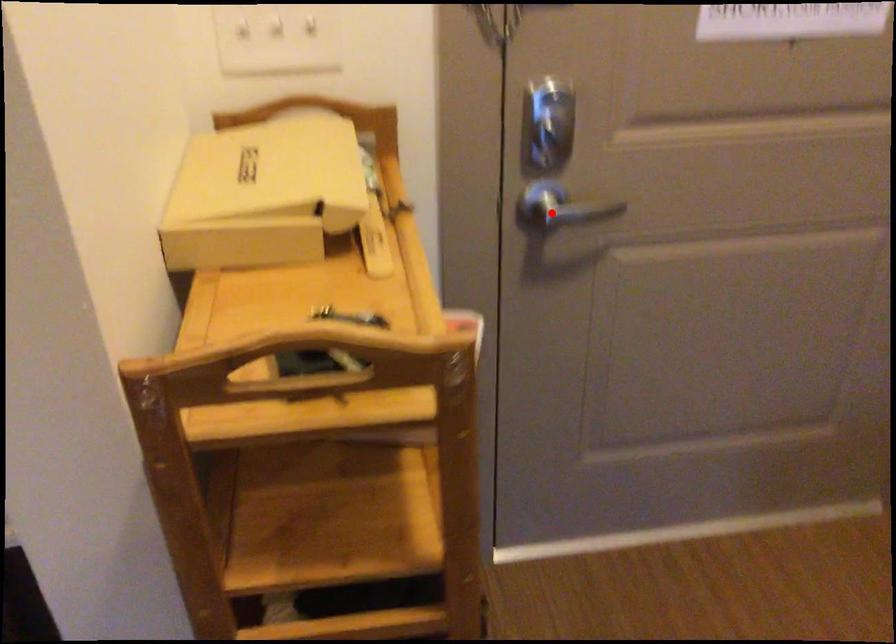
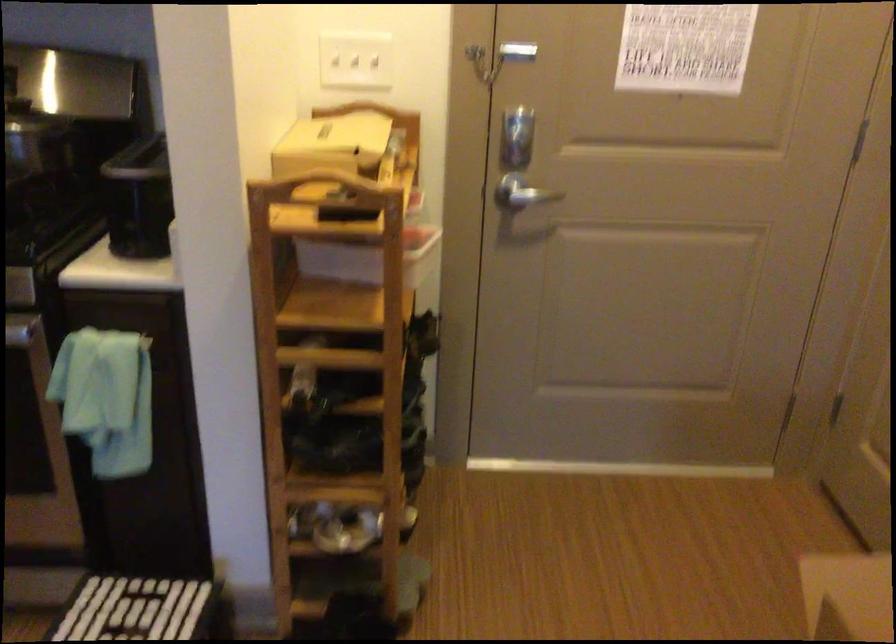
Where in the second image is the point corresponding to the highlighted location from the first image?

(521, 193)